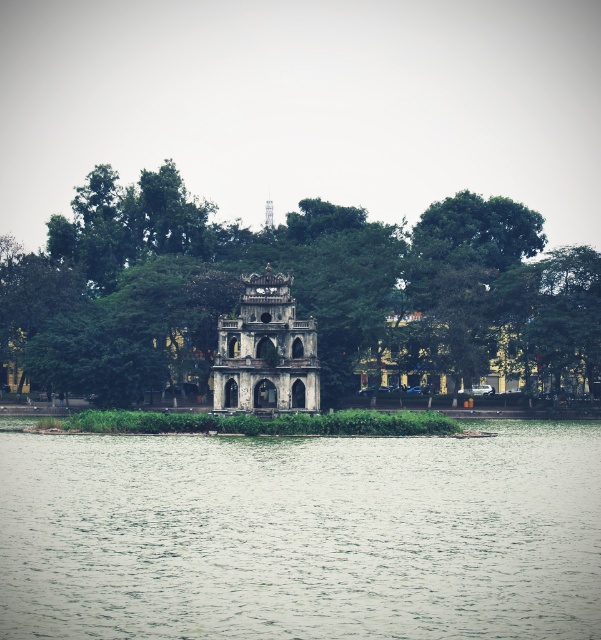
You are a boat operator who needs to navigate a boat with a length of 15 meters through the water. Given the distance between the green water at center and the stone aged tower at center, can the boat fit between them without touching either?

The distance between the green water at center and the stone aged tower at center is 16.17 meters. Since the boat is 15 meters long, it can fit between them as there is enough space.

You are a drone operator trying to capture a photo of the green water at center and the green leafy tree at center. Which object should you focus on first if you want to ensure both are in frame without moving the camera?

You should focus on the green leafy tree at center first because it is larger than the green water at center, so centering it will ensure the smaller green water at center remains within the frame.

You are standing on the path leading to the stone aged tower at center and want to reach it. There is a green leafy tree at center blocking your way. Can you walk around the tree to get to the tower?

The green leafy tree at center is further to the viewer than the stone aged tower at center, so the tree is closer to you. This means you can easily walk around the tree to reach the tower since it is in front of you.